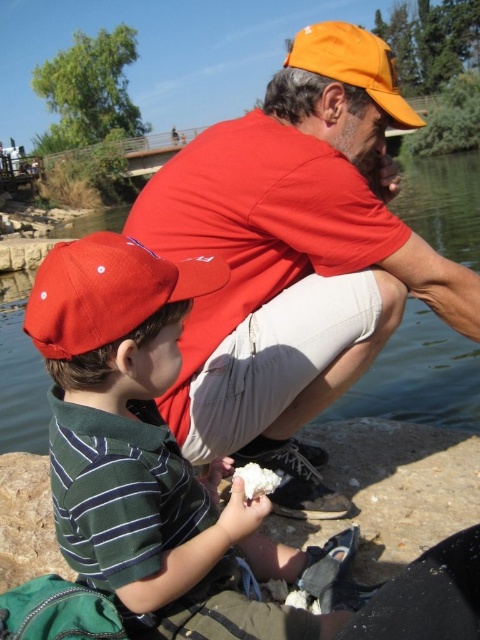
From the picture: Is green striped shirt at lower left to the right of orange fabric baseball cap at upper center from the viewer's perspective?

No, green striped shirt at lower left is not to the right of orange fabric baseball cap at upper center.

Can you confirm if green striped shirt at lower left is smaller than orange fabric baseball cap at upper center?

Yes.

Is point (193, 568) farther from viewer compared to point (380, 58)?

No.

I want to click on green striped shirt at lower left, so click(152, 456).

Between green striped shirt at lower left and matte red baseball cap at left, which one has more height?

green striped shirt at lower left

Is green striped shirt at lower left to the left of matte red baseball cap at left from the viewer's perspective?

In fact, green striped shirt at lower left is to the right of matte red baseball cap at left.

The width and height of the screenshot is (480, 640). I want to click on green striped shirt at lower left, so click(x=152, y=456).

Is orange cotton cap at upper center shorter than matte red baseball cap at left?

No, orange cotton cap at upper center is not shorter than matte red baseball cap at left.

Identify the location of orange cotton cap at upper center. (294, 259).